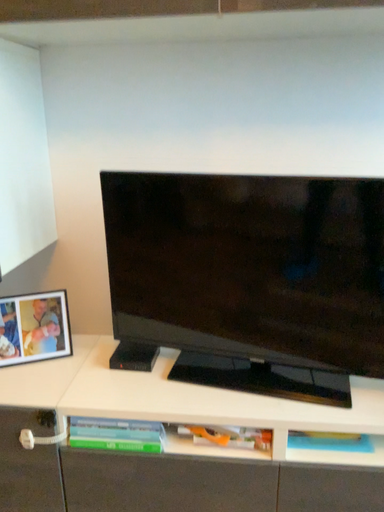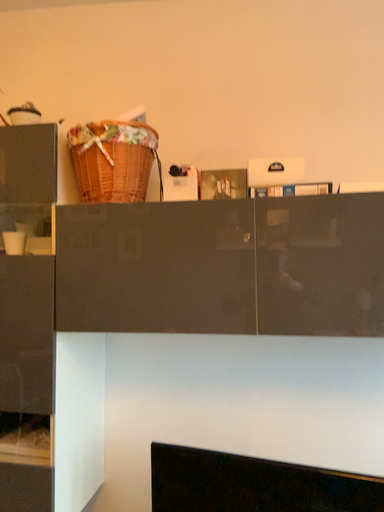
Question: Which way did the camera rotate in the video?

Choices:
 (A) rotated downward
 (B) rotated upward

Answer: (B)